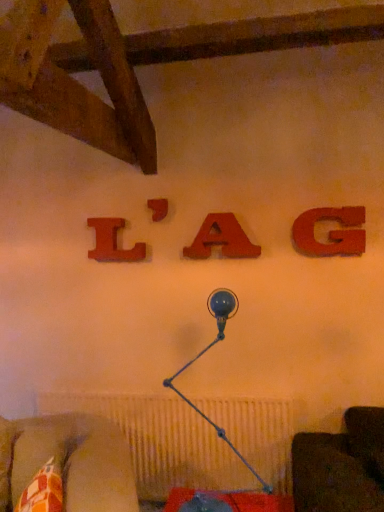
Question: Does matte wood letter a at center, positioned as the 3th alphabet in left-to-right order, appear on the left side of blue glass table lamp at center?

Choices:
 (A) no
 (B) yes

Answer: (A)

Question: From the image's perspective, does matte wood letter a at center, positioned as the 3th alphabet in left-to-right order, appear lower than blue glass table lamp at center?

Choices:
 (A) no
 (B) yes

Answer: (A)

Question: Are matte wood letter a at center, placed as the second alphabet when sorted from right to left, and blue glass table lamp at center beside each other?

Choices:
 (A) no
 (B) yes

Answer: (A)

Question: Is matte wood letter a at center, positioned as the 3th alphabet in left-to-right order, oriented away from blue glass table lamp at center?

Choices:
 (A) yes
 (B) no

Answer: (B)

Question: Does matte wood letter a at center, placed as the second alphabet when sorted from right to left, come in front of blue glass table lamp at center?

Choices:
 (A) yes
 (B) no

Answer: (B)

Question: Looking at the image, does matte wood letter a at center, positioned as the 3th alphabet in left-to-right order, seem bigger or smaller compared to matte wood letter at center, which ranks as the 2th alphabet in left-to-right order?

Choices:
 (A) small
 (B) big

Answer: (B)

Question: Does point (213, 238) appear closer or farther from the camera than point (157, 215)?

Choices:
 (A) closer
 (B) farther

Answer: (A)

Question: Is matte wood letter a at center, placed as the second alphabet when sorted from right to left, to the left or to the right of matte wood letter at center, which is the 3th alphabet in right-to-left order, in the image?

Choices:
 (A) right
 (B) left

Answer: (A)

Question: Is matte wood letter a at center, placed as the second alphabet when sorted from right to left, inside the boundaries of matte wood letter at center, which ranks as the 2th alphabet in left-to-right order, or outside?

Choices:
 (A) inside
 (B) outside

Answer: (B)

Question: Looking at their shapes, would you say blue glass table lamp at center is wider or thinner than wooden letter l at upper center, the 1th alphabet viewed from the left?

Choices:
 (A) wide
 (B) thin

Answer: (A)

Question: Would you say blue glass table lamp at center is inside or outside wooden letter l at upper center, the 1th alphabet viewed from the left?

Choices:
 (A) inside
 (B) outside

Answer: (B)

Question: Would you say blue glass table lamp at center is to the left or to the right of wooden letter l at upper center, which appears as the fourth alphabet when viewed from the right, in the picture?

Choices:
 (A) left
 (B) right

Answer: (B)

Question: From the image's perspective, is blue glass table lamp at center located above or below wooden letter l at upper center, which appears as the fourth alphabet when viewed from the right?

Choices:
 (A) below
 (B) above

Answer: (A)

Question: Is point (94, 248) closer or farther from the camera than point (162, 198)?

Choices:
 (A) farther
 (B) closer

Answer: (A)

Question: Based on their sizes in the image, would you say wooden letter l at upper center, the 1th alphabet viewed from the left, is bigger or smaller than matte wood letter at center, which is the 3th alphabet in right-to-left order?

Choices:
 (A) big
 (B) small

Answer: (A)